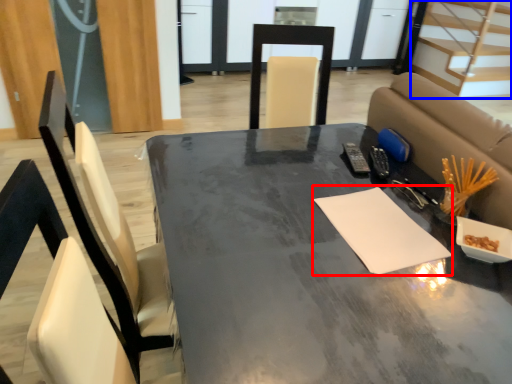
Question: Which point is closer to the camera, notepad (highlighted by a red box) or stairwell (highlighted by a blue box)?

Choices:
 (A) notepad
 (B) stairwell

Answer: (A)